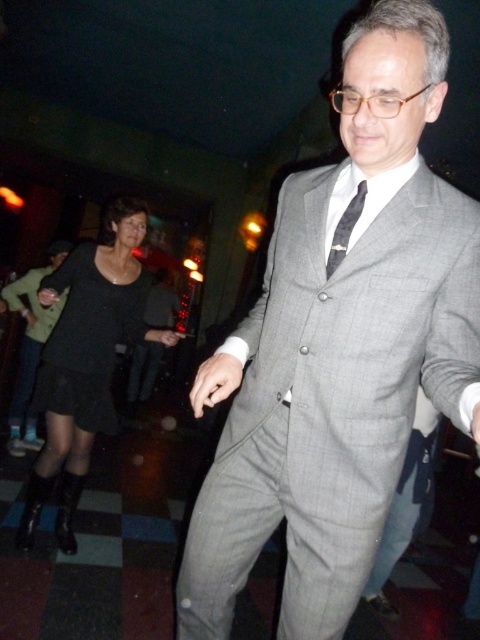
Question: Is black matte dress at left above matte black dress at lower left?

Choices:
 (A) no
 (B) yes

Answer: (B)

Question: Which object appears farthest from the camera in this image?

Choices:
 (A) gray wool suit at center
 (B) matte black dress at lower left

Answer: (B)

Question: Does black matte dress at left appear under matte black dress at lower left?

Choices:
 (A) yes
 (B) no

Answer: (B)

Question: Which is farther from the gray wool suit at center?

Choices:
 (A) black matte dress at left
 (B) black silk tie at center
 (C) black matte dress at lower left

Answer: (A)

Question: Which is farther from the black matte dress at left?

Choices:
 (A) black matte dress at lower left
 (B) matte black dress at lower left
 (C) gray wool suit at center

Answer: (C)

Question: Does black matte dress at lower left appear on the right side of matte black dress at lower left?

Choices:
 (A) yes
 (B) no

Answer: (A)